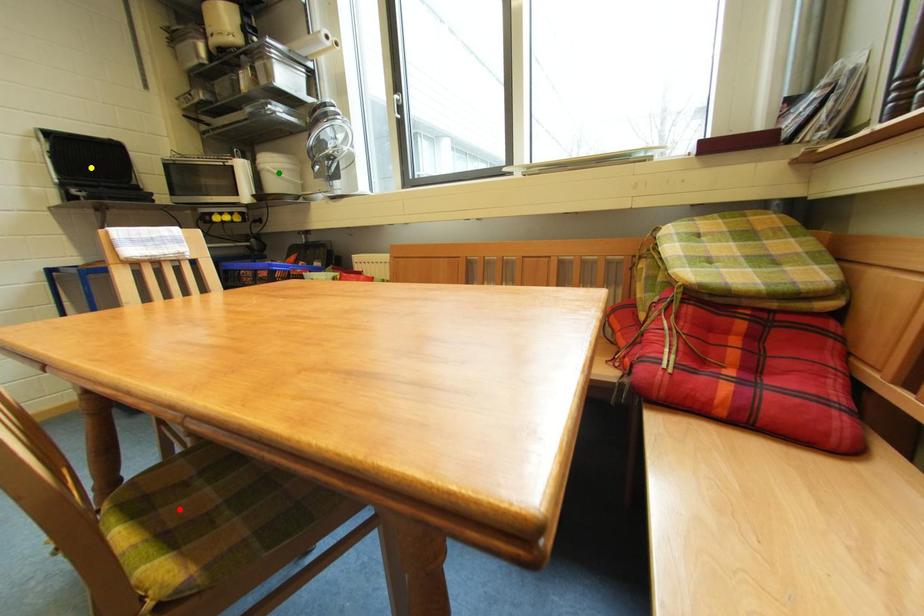
Order these from nearest to farthest:
yellow point | red point | green point

red point → yellow point → green point